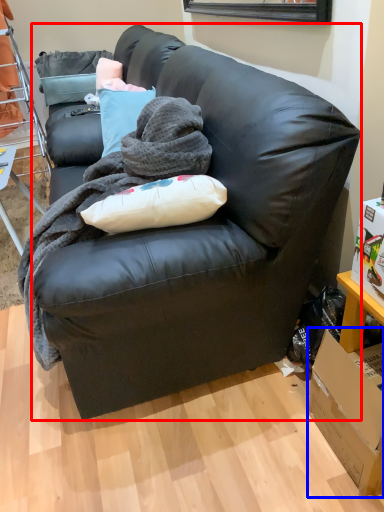
Question: Which object is closer to the camera taking this photo, studio couch (highlighted by a red box) or box (highlighted by a blue box)?

Choices:
 (A) studio couch
 (B) box

Answer: (A)